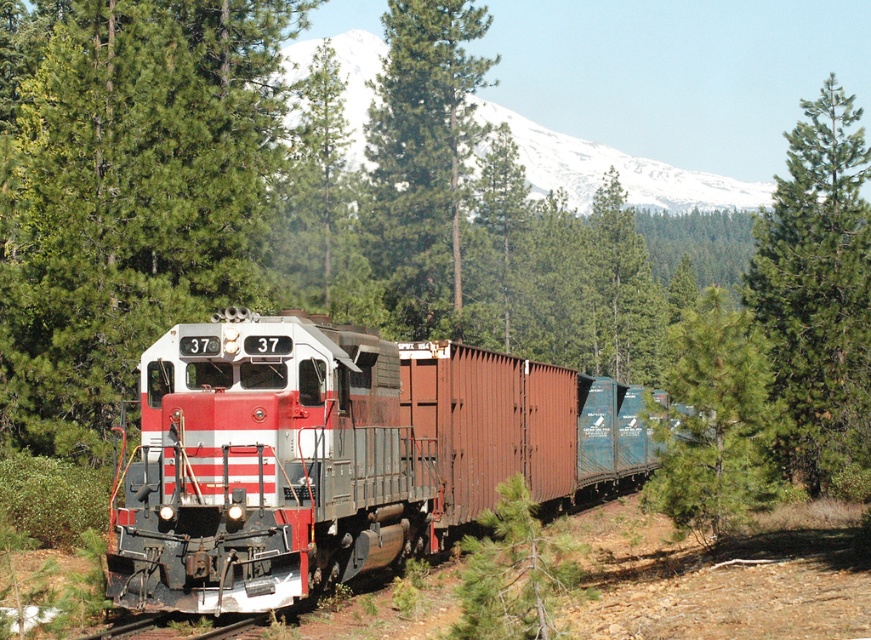
You are a photographer standing at the edge of the forest, aiming to capture the matte red train at center and the metal at bottom in your shot. Based on their sizes, which object should you focus on first to ensure it fills the frame adequately?

The matte red train at center is larger than the metal at bottom, so you should focus on the matte red train at center first to ensure it fills the frame adequately.

You are a photographer standing at the center of the scene. You want to capture a photo that includes both the green textured pine tree at right and the metal at bottom. Which object should you adjust your camera angle to focus on first to ensure both are in the frame?

The green textured pine tree at right is larger than the metal at bottom, so you should focus on the larger green textured pine tree at right first to ensure both fit in the frame.

You are a train engineer observing the forest ahead. You notice two trees at the center of your view, a green textured tree at center and a green matte tree at center. Which tree takes up less visual space in your current view?

The green textured tree at center occupies less space than the green matte tree at center, so the green textured tree at center takes up less visual space in your current view.